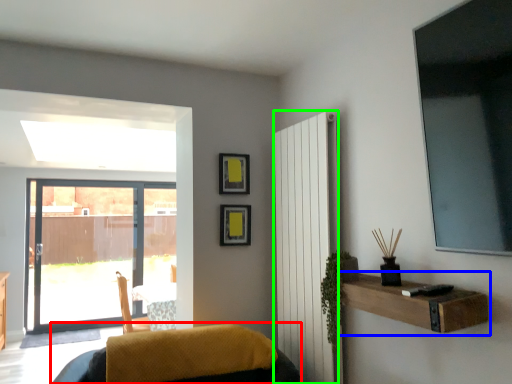
Question: Considering the real-world distances, which object is farthest from furniture (highlighted by a red box)? shelf (highlighted by a blue box) or radiator (highlighted by a green box)?

Choices:
 (A) shelf
 (B) radiator

Answer: (A)